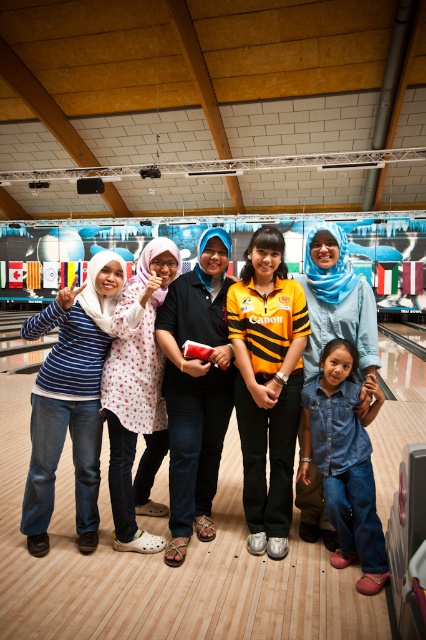
Who is more distant from viewer, [198,484] or [362,472]?

The point [198,484] is behind.

Does black matte shirt at center appear over denim jeans at lower right?

Indeed, black matte shirt at center is positioned over denim jeans at lower right.

Is point (222, 408) positioned in front of point (373, 584)?

No, it is not.

Identify the location of black matte shirt at center. (195, 388).

Between denim jeans at center and black matte shirt at center, which one is positioned higher?

black matte shirt at center is above.

What do you see at coordinates (236, 384) in the screenshot?
I see `denim jeans at center` at bounding box center [236, 384].

Where is `denim jeans at center`? Image resolution: width=426 pixels, height=640 pixels. denim jeans at center is located at coordinates (236, 384).

Who is more distant from viewer, (314,241) or (339,385)?

The point (314,241) is behind.

Between denim jeans at center and denim jeans at lower right, which one is positioned lower?

denim jeans at lower right is lower down.

Is point (371, 364) positioned behind point (333, 522)?

Yes, point (371, 364) is farther from viewer.

Locate an element on the screen. Image resolution: width=426 pixels, height=640 pixels. denim jeans at center is located at coordinates tap(236, 384).